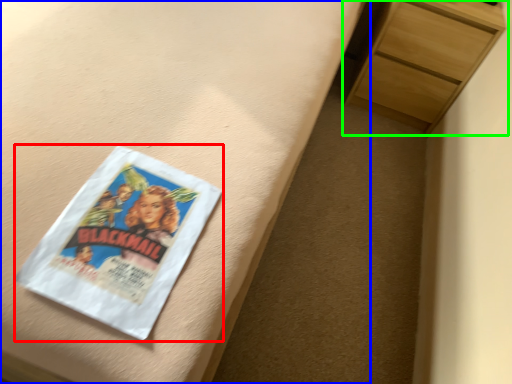
Question: Which is nearer to the paperback book (highlighted by a red box)? bed frame (highlighted by a blue box) or chest of drawers (highlighted by a green box).

Choices:
 (A) bed frame
 (B) chest of drawers

Answer: (A)